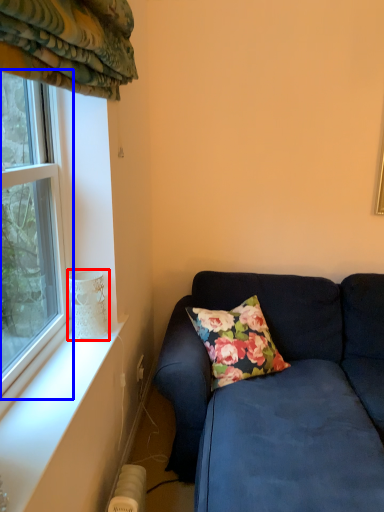
Question: Which object appears closest to the camera in this image, glass vase (highlighted by a red box) or window (highlighted by a blue box)?

Choices:
 (A) glass vase
 (B) window

Answer: (B)